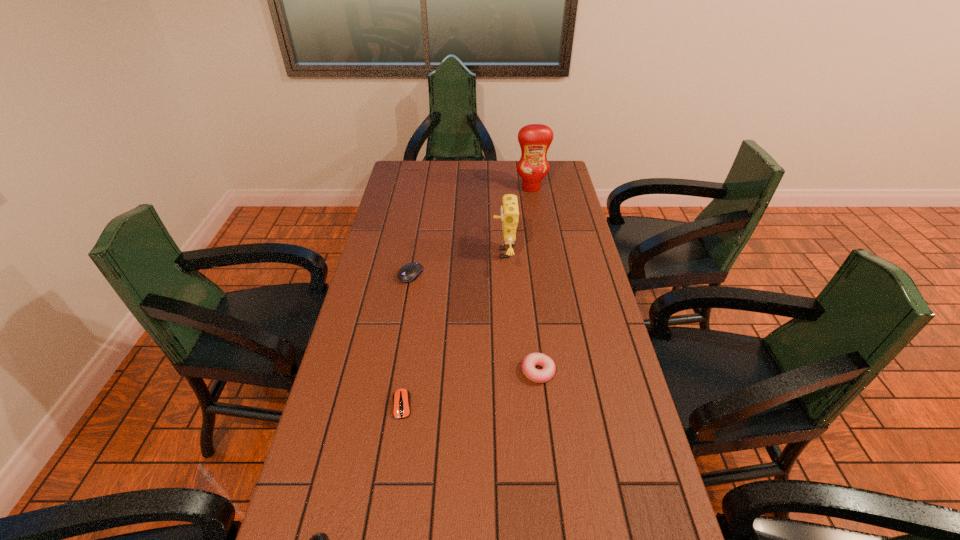
Where is `free point located 0.190m on the back of the tallest computer mouse`? free point located 0.190m on the back of the tallest computer mouse is located at coordinates (418, 233).

Locate an element on the screen. The width and height of the screenshot is (960, 540). vacant space located 0.210m on the front of the doughnut is located at coordinates (549, 463).

This screenshot has height=540, width=960. Find the location of `free space located 0.170m on the back of the second farthest computer mouse`. free space located 0.170m on the back of the second farthest computer mouse is located at coordinates (412, 341).

The width and height of the screenshot is (960, 540). What are the coordinates of `object at the far edge` in the screenshot? It's located at (534, 139).

You are a GUI agent. You are given a task and a screenshot of the screen. Output one action in this format:
    pyautogui.click(x=<x>, y=<y>)
    Task: Click on the object that is at the left edge
    
    Given the screenshot: What is the action you would take?
    pyautogui.click(x=409, y=272)

You are a GUI agent. You are given a task and a screenshot of the screen. Output one action in this format:
    pyautogui.click(x=<x>, y=<y>)
    Task: Click on the object located at the right edge
    
    Given the screenshot: What is the action you would take?
    pyautogui.click(x=534, y=139)

Identify the location of object that is at the far right corner. (534, 139).

Image resolution: width=960 pixels, height=540 pixels. I want to click on vacant space at the far edge of the desktop, so click(x=433, y=161).

In the image, there is a desktop. Where is `vacant space at the left edge`? Image resolution: width=960 pixels, height=540 pixels. vacant space at the left edge is located at coordinates (423, 197).

The image size is (960, 540). I want to click on free spot at the right edge of the desktop, so click(x=586, y=477).